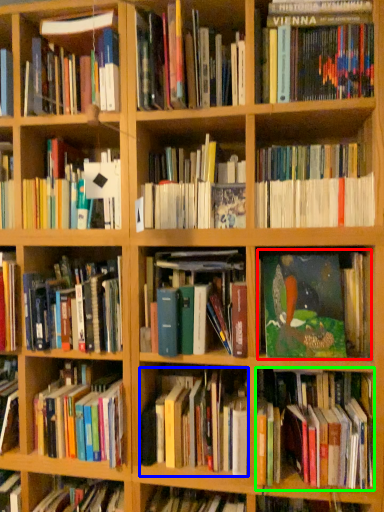
Question: Which is nearer to the book (highlighted by a red box)? book (highlighted by a blue box) or book (highlighted by a green box).

Choices:
 (A) book
 (B) book

Answer: (B)